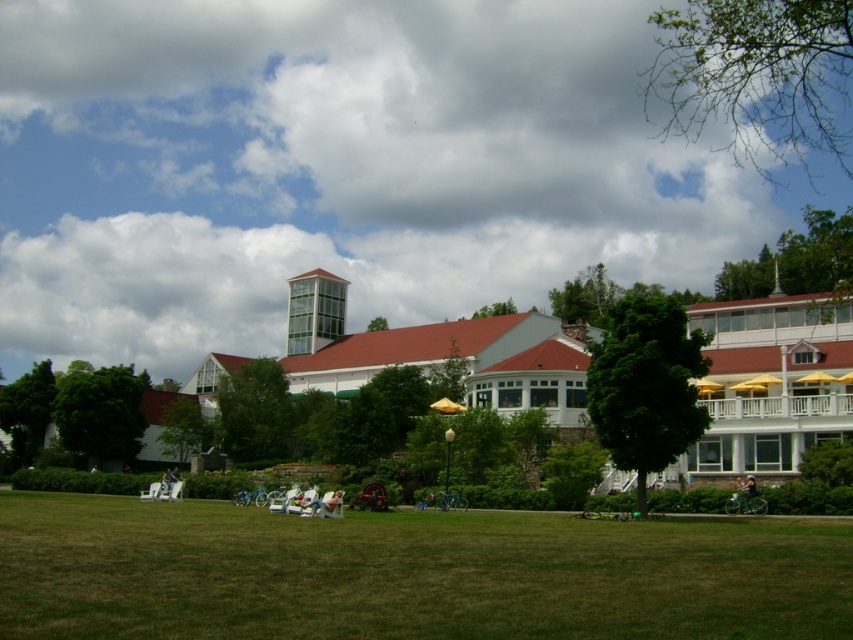
You are planning to take a photo of the cloudy sky at upper center and green grass at lower center. Which one should you focus on if you want to capture the wider object in the scene?

The cloudy sky at upper center should be focused on because its width surpasses that of the green grass at lower center, making it the wider object in the scene.